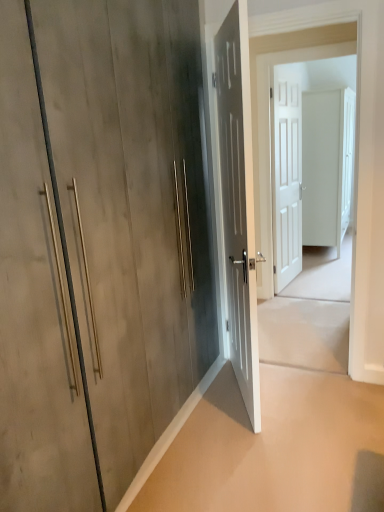
You are a GUI agent. You are given a task and a screenshot of the screen. Output one action in this format:
    pyautogui.click(x=<x>, y=<y>)
    Task: Click on the space that is in front of matte gray door at center, which is the 2th door in front-to-back order
    The image size is (384, 512).
    Given the screenshot: What is the action you would take?
    pyautogui.click(x=254, y=448)